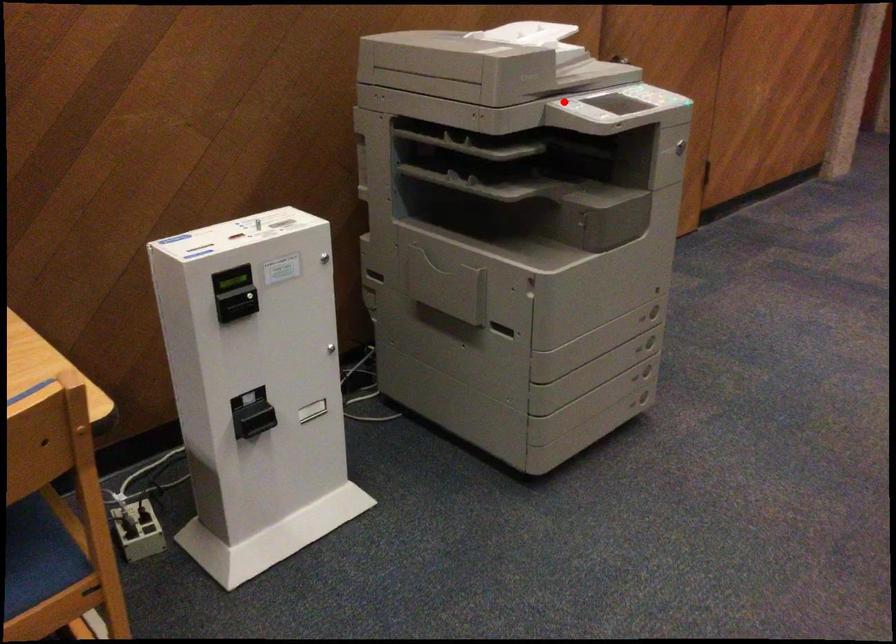
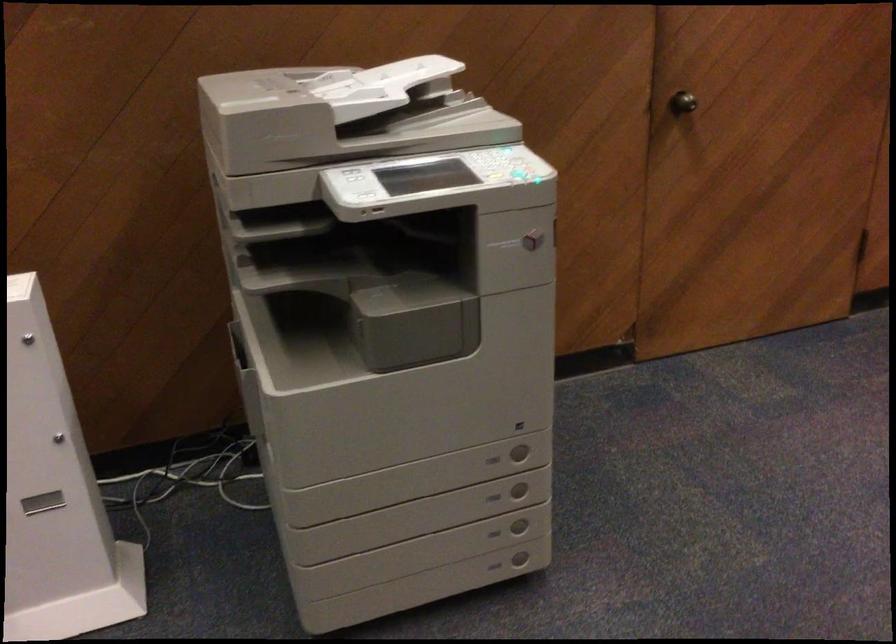
Question: I am providing you with two images of the same scene from different viewpoints. In image1, a red point is highlighted. Considering the same 3D point in image2, which of the following is correct?

Choices:
 (A) It is closer
 (B) It is farther

Answer: (A)